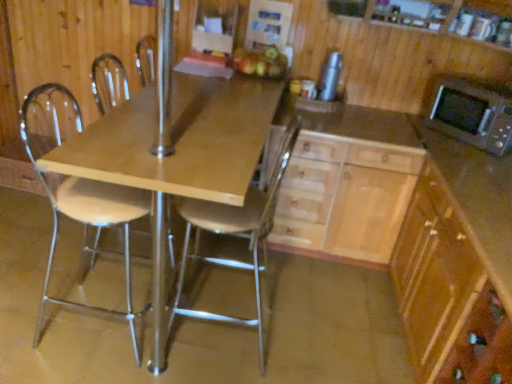
What is the approximate width of matte wood table at center?

It is 5.69 feet.

Where is `silver metallic thermos at upper right`? silver metallic thermos at upper right is located at coordinates (329, 76).

At what (x,y) coordinates should I click in order to perform the action: click on light brown wood cabinet at lower right, which is the second cabinetry from left to right. Please return your answer as a coordinate pair (x, y). Looking at the image, I should click on (434, 274).

How much space does white plastic chair at left, arranged as the first chair when viewed from the left, occupy vertically?

The height of white plastic chair at left, arranged as the first chair when viewed from the left, is 1.09 meters.

Where is `metallic silver chair at center, the 1th chair in the right-to-left sequence`? The width and height of the screenshot is (512, 384). metallic silver chair at center, the 1th chair in the right-to-left sequence is located at coordinates (237, 232).

The height and width of the screenshot is (384, 512). I want to click on silver metallic microwave oven at upper right, so click(x=473, y=114).

Is white plastic chair at left, the second chair viewed from the right, smaller than light brown wood cabinet at lower right, acting as the 1th cabinetry starting from the right?

Indeed, white plastic chair at left, the second chair viewed from the right, has a smaller size compared to light brown wood cabinet at lower right, acting as the 1th cabinetry starting from the right.

Considering the sizes of objects white plastic chair at left, arranged as the first chair when viewed from the left, and light brown wood cabinet at lower right, which is the second cabinetry from left to right, in the image provided, who is shorter, white plastic chair at left, arranged as the first chair when viewed from the left, or light brown wood cabinet at lower right, which is the second cabinetry from left to right,?

With less height is light brown wood cabinet at lower right, which is the second cabinetry from left to right.

Considering the points (128, 296) and (439, 197), which point is in front, point (128, 296) or point (439, 197)?

Positioned in front is point (439, 197).

Where is `chair that is the 1st object above the light brown wood cabinet at lower right, which is the second cabinetry from left to right (from a real-world perspective)`? The height and width of the screenshot is (384, 512). chair that is the 1st object above the light brown wood cabinet at lower right, which is the second cabinetry from left to right (from a real-world perspective) is located at coordinates (78, 189).

Would you say silver metallic microwave oven at upper right is to the left or to the right of matte wood table at center in the picture?

From the image, it's evident that silver metallic microwave oven at upper right is to the right of matte wood table at center.

Is matte wood table at center at the back of silver metallic microwave oven at upper right?

No, silver metallic microwave oven at upper right is not facing the opposite direction of matte wood table at center.

Relative to matte wood table at center, is silver metallic microwave oven at upper right in front or behind?

silver metallic microwave oven at upper right is behind matte wood table at center.

Is silver metallic microwave oven at upper right situated inside matte wood table at center or outside?

The correct answer is: outside.

From the image's perspective, is matte wood table at center on top of silver metallic thermos at upper right?

No, from the image's perspective, matte wood table at center is not above silver metallic thermos at upper right.

Looking at the image, does matte wood table at center seem bigger or smaller compared to silver metallic thermos at upper right?

Considering their sizes, matte wood table at center takes up more space than silver metallic thermos at upper right.

From a real-world perspective, is matte wood table at center positioned above or below silver metallic thermos at upper right?

In terms of real-world spatial position, matte wood table at center is below silver metallic thermos at upper right.

Based on the photo, can you confirm if matte wood table at center is taller than silver metallic thermos at upper right?

Yes, matte wood table at center is taller than silver metallic thermos at upper right.

Which object is closer to the camera, matte wood table at center or wooden cabinet at center?

wooden cabinet at center is more forward.

Does matte wood table at center turn towards wooden cabinet at center?

No, matte wood table at center is not facing towards wooden cabinet at center.

Is matte wood table at center outside of wooden cabinet at center?

Indeed, matte wood table at center is completely outside wooden cabinet at center.

Is matte wood table at center thinner than wooden cabinet at center?

In fact, matte wood table at center might be wider than wooden cabinet at center.

Can you tell me how much white plastic chair at left, the second chair viewed from the right, and metallic silver chair at center, the 1th chair in the right-to-left sequence, differ in facing direction?

179 degrees.

Would you say white plastic chair at left, the second chair viewed from the right, is outside metallic silver chair at center, which is counted as the second chair, starting from the left?

Indeed, white plastic chair at left, the second chair viewed from the right, is completely outside metallic silver chair at center, which is counted as the second chair, starting from the left.

In the scene shown: Are white plastic chair at left, arranged as the first chair when viewed from the left, and metallic silver chair at center, the 1th chair in the right-to-left sequence, beside each other?

No.

From the image's perspective, which object appears higher, white plastic chair at left, arranged as the first chair when viewed from the left, or metallic silver chair at center, which is counted as the second chair, starting from the left?

From the image's view, white plastic chair at left, arranged as the first chair when viewed from the left, is above.

Which is farther, [439,212] or [395,168]?

The point [395,168] is more distant.

Is light brown wood cabinet at lower right, which is the second cabinetry from left to right, looking in the opposite direction of light wood/wooden cabinet at center, acting as the second cabinetry starting from the right?

light brown wood cabinet at lower right, which is the second cabinetry from left to right, is not turned away from light wood/wooden cabinet at center, acting as the second cabinetry starting from the right.

Considering the relative positions of light brown wood cabinet at lower right, acting as the 1th cabinetry starting from the right, and light wood/wooden cabinet at center, acting as the second cabinetry starting from the right, in the image provided, is light brown wood cabinet at lower right, acting as the 1th cabinetry starting from the right, to the right of light wood/wooden cabinet at center, acting as the second cabinetry starting from the right, from the viewer's perspective?

Indeed, light brown wood cabinet at lower right, acting as the 1th cabinetry starting from the right, is positioned on the right side of light wood/wooden cabinet at center, acting as the second cabinetry starting from the right.

Does light brown wood cabinet at lower right, acting as the 1th cabinetry starting from the right, have a greater width compared to light wood/wooden cabinet at center, the first cabinetry viewed from the left?

Correct, the width of light brown wood cabinet at lower right, acting as the 1th cabinetry starting from the right, exceeds that of light wood/wooden cabinet at center, the first cabinetry viewed from the left.

From a real-world perspective, is light wood/wooden cabinet at center, the first cabinetry viewed from the left, below matte wood table at center?

Indeed, from a real-world perspective, light wood/wooden cabinet at center, the first cabinetry viewed from the left, is positioned beneath matte wood table at center.

Does point (409, 149) appear closer or farther from the camera than point (221, 199)?

Point (409, 149).

Choose the correct answer: Is light wood/wooden cabinet at center, the first cabinetry viewed from the left, inside matte wood table at center or outside it?

light wood/wooden cabinet at center, the first cabinetry viewed from the left, cannot be found inside matte wood table at center.

Is matte wood table at center at the back of light wood/wooden cabinet at center, the first cabinetry viewed from the left?

No, light wood/wooden cabinet at center, the first cabinetry viewed from the left, is not facing away from matte wood table at center.

Where is `cabinetry in front of the white plastic chair at left, the second chair viewed from the right`? This screenshot has width=512, height=384. cabinetry in front of the white plastic chair at left, the second chair viewed from the right is located at coordinates (434, 274).

Image resolution: width=512 pixels, height=384 pixels. What are the coordinates of `table below the silver metallic microwave oven at upper right (from a real-world perspective)` in the screenshot? It's located at (176, 157).

Estimate the real-world distances between objects in this image. Which object is further from silver metallic microwave oven at upper right, light wood/wooden cabinet at center, acting as the second cabinetry starting from the right, or light brown wood cabinet at lower right, acting as the 1th cabinetry starting from the right?

Based on the image, light brown wood cabinet at lower right, acting as the 1th cabinetry starting from the right, appears to be further to silver metallic microwave oven at upper right.

Considering their positions, is metallic silver chair at center, which is counted as the second chair, starting from the left, positioned closer to light brown wood cabinet at lower right, which is the second cabinetry from left to right, than white plastic chair at left, the second chair viewed from the right?

The object closer to light brown wood cabinet at lower right, which is the second cabinetry from left to right, is metallic silver chair at center, which is counted as the second chair, starting from the left.

Estimate the real-world distances between objects in this image. Which object is closer to silver metallic thermos at upper right, white plastic chair at left, arranged as the first chair when viewed from the left, or light wood/wooden cabinet at center, acting as the second cabinetry starting from the right?

light wood/wooden cabinet at center, acting as the second cabinetry starting from the right, is closer to silver metallic thermos at upper right.

When comparing their distances from metallic silver chair at center, the 1th chair in the right-to-left sequence, does wooden cabinet at center or silver metallic thermos at upper right seem further?

The object further to metallic silver chair at center, the 1th chair in the right-to-left sequence, is silver metallic thermos at upper right.

Considering their positions, is matte wood table at center positioned further to wooden cabinet at center than light brown wood cabinet at lower right, acting as the 1th cabinetry starting from the right?

The object further to wooden cabinet at center is matte wood table at center.

From the image, which object appears to be nearer to matte wood table at center, light brown wood cabinet at lower right, acting as the 1th cabinetry starting from the right, or metallic silver chair at center, which is counted as the second chair, starting from the left?

metallic silver chair at center, which is counted as the second chair, starting from the left, is closer to matte wood table at center.

From the image, which object appears to be nearer to white plastic chair at left, arranged as the first chair when viewed from the left, silver metallic thermos at upper right or metallic silver chair at center, the 1th chair in the right-to-left sequence?

metallic silver chair at center, the 1th chair in the right-to-left sequence, lies closer to white plastic chair at left, arranged as the first chair when viewed from the left, than the other object.

Estimate the real-world distances between objects in this image. Which object is closer to light wood/wooden cabinet at center, the first cabinetry viewed from the left, silver metallic microwave oven at upper right or light brown wood cabinet at lower right, which is the second cabinetry from left to right?

Among the two, light brown wood cabinet at lower right, which is the second cabinetry from left to right, is located nearer to light wood/wooden cabinet at center, the first cabinetry viewed from the left.

Where is `appliance located between white plastic chair at left, arranged as the first chair when viewed from the left, and light brown wood cabinet at lower right, which is the second cabinetry from left to right, in the left-right direction`? The width and height of the screenshot is (512, 384). appliance located between white plastic chair at left, arranged as the first chair when viewed from the left, and light brown wood cabinet at lower right, which is the second cabinetry from left to right, in the left-right direction is located at coordinates (329, 76).

At what (x,y) coordinates should I click in order to perform the action: click on cabinetry located between metallic silver chair at center, which is counted as the second chair, starting from the left, and silver metallic thermos at upper right in the depth direction. Please return your answer as a coordinate pair (x, y). The height and width of the screenshot is (384, 512). Looking at the image, I should click on (345, 197).

I want to click on chair between white plastic chair at left, arranged as the first chair when viewed from the left, and light brown wood cabinet at lower right, acting as the 1th cabinetry starting from the right, so click(x=237, y=232).

This screenshot has height=384, width=512. I want to click on cabinetry between matte wood table at center and light brown wood cabinet at lower right, which is the second cabinetry from left to right, so click(345, 197).